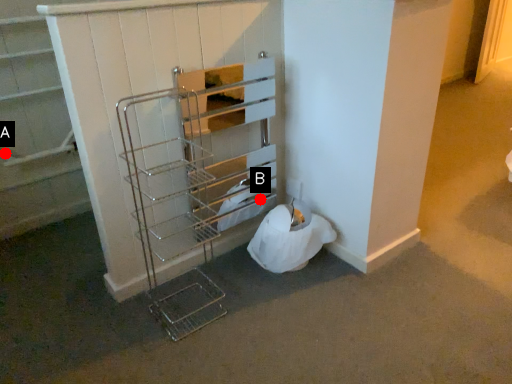
Question: Two points are circled on the image, labeled by A and B beside each circle. Which point is closer to the camera?

Choices:
 (A) A is closer
 (B) B is closer

Answer: (B)